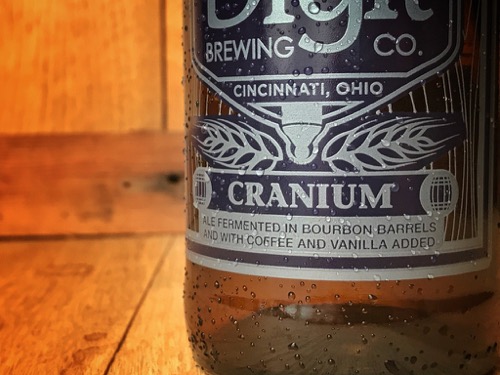
You are a GUI agent. You are given a task and a screenshot of the screen. Output one action in this format:
    pyautogui.click(x=<x>, y=<y>)
    Task: Click on the wall
    The width and height of the screenshot is (500, 375).
    Given the screenshot: What is the action you would take?
    pyautogui.click(x=55, y=95)